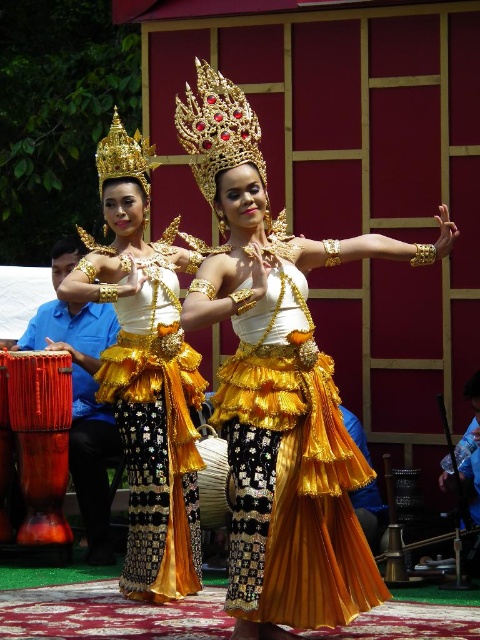
Question: Which object appears closest to the camera in this image?

Choices:
 (A) gold metallic skirt at center
 (B) gold satin skirt at center
 (C) gold textured skirt at center

Answer: (B)

Question: Which object appears farthest from the camera in this image?

Choices:
 (A) gold textured skirt at center
 (B) gold satin skirt at center

Answer: (A)

Question: Can you confirm if gold textured skirt at center is thinner than gold satin skirt at center?

Choices:
 (A) no
 (B) yes

Answer: (A)

Question: Does gold textured skirt at center have a lesser width compared to gold satin skirt at center?

Choices:
 (A) no
 (B) yes

Answer: (A)

Question: Does gold textured skirt at center appear on the left side of gold satin skirt at center?

Choices:
 (A) no
 (B) yes

Answer: (A)

Question: Estimate the real-world distances between objects in this image. Which object is closer to the gold textured skirt at center?

Choices:
 (A) gold metallic skirt at center
 (B) gold satin skirt at center

Answer: (B)